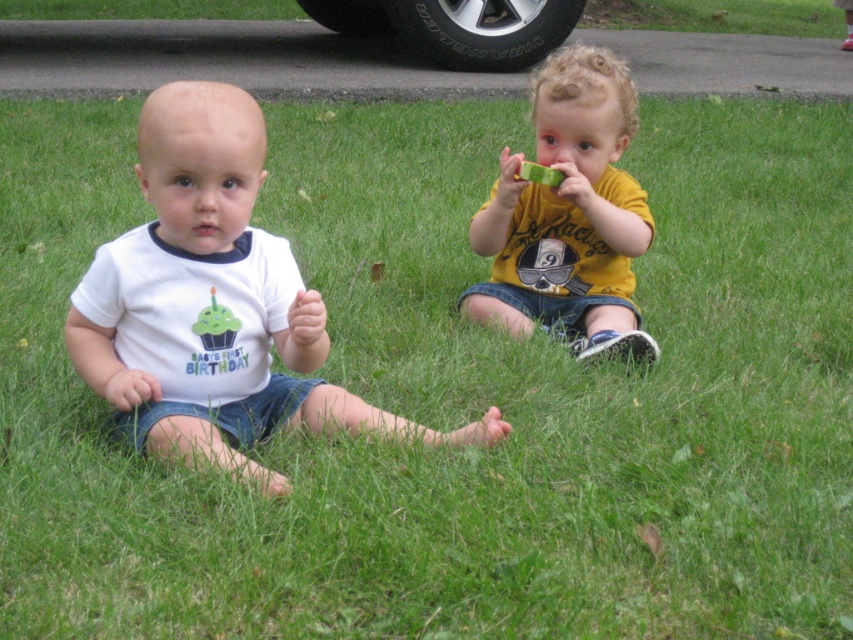
You are a photographer setting up for a birthday photo shoot. You have two shirts to feature in the image. The white cotton shirt at left and the yellow matte shirt at center. Based on their sizes, which shirt should you focus on to ensure it stands out more in the photo?

The white cotton shirt at left has a larger size compared to the yellow matte shirt at center, so focusing on the white cotton shirt at left will make it stand out more due to its bigger size.